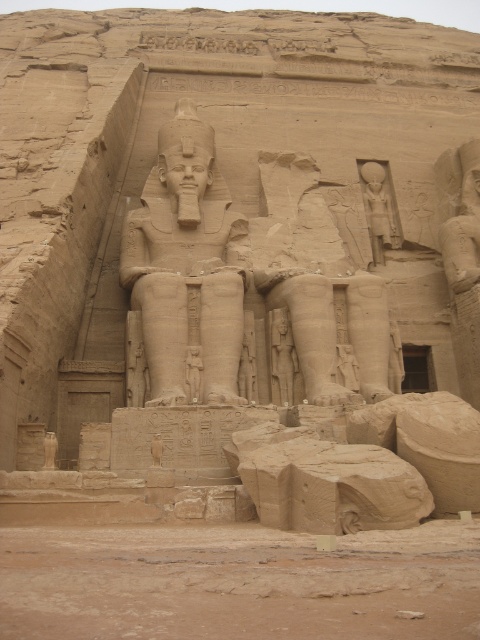
Question: Does sandstone statue at center have a greater width compared to smooth stone statue at center?

Choices:
 (A) yes
 (B) no

Answer: (A)

Question: Among these objects, which one is farthest from the camera?

Choices:
 (A) sandstone statue at center
 (B) smooth stone statue at upper right
 (C) smooth stone statue at center

Answer: (B)

Question: Is sandstone statue at center to the right of smooth stone statue at upper right from the viewer's perspective?

Choices:
 (A) yes
 (B) no

Answer: (B)

Question: Among these objects, which one is farthest from the camera?

Choices:
 (A) smooth stone statue at upper right
 (B) smooth stone statue at center
 (C) sandstone statue at center

Answer: (A)

Question: Which object is positioned farthest from the sandstone statue at center?

Choices:
 (A) smooth stone statue at center
 (B) smooth stone statue at upper right

Answer: (B)

Question: Is smooth stone statue at upper right thinner than smooth stone statue at center?

Choices:
 (A) no
 (B) yes

Answer: (A)